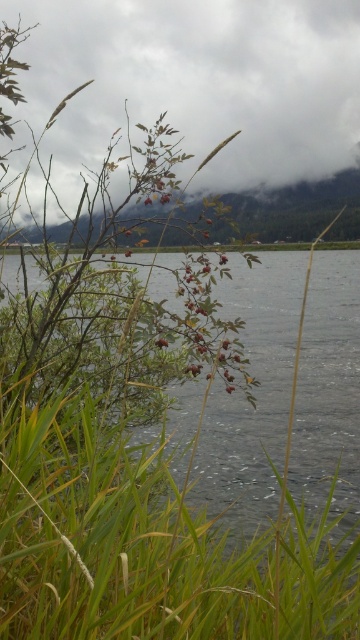
You are standing in the serene natural scene described. You notice a point at coordinates [196,83]. What object is located at this point?

The cloudy sky at upper center is located at point [196,83].

You are standing at the edge of the lake and want to know if you can see the cloudy sky at upper center reflected in the smooth gray water at center. Based on their distance, can you determine if the reflection is possible?

The cloudy sky at upper center and smooth gray water at center are 3.98 meters apart from each other. Since reflections require the object to be above the water and the distance doesn not directly affect reflection possibility, the cloudy sky at upper center can be reflected in the smooth gray water at center as long as the water surface is calm enough.

You are an artist planning to paint this autumn scene. You want to emphasize the cloudy sky at upper center and the smooth gray water at center. Which of these two elements should you paint first if you want to follow the principle of starting with larger areas?

The cloudy sky at upper center should be painted first because it has a larger size compared to the smooth gray water at center, aligning with the principle of starting with larger areas.